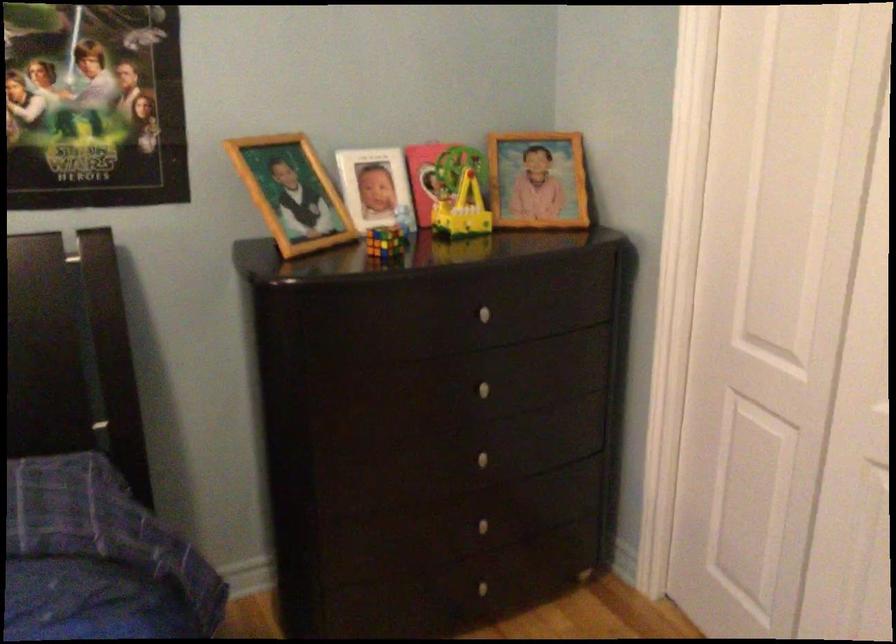
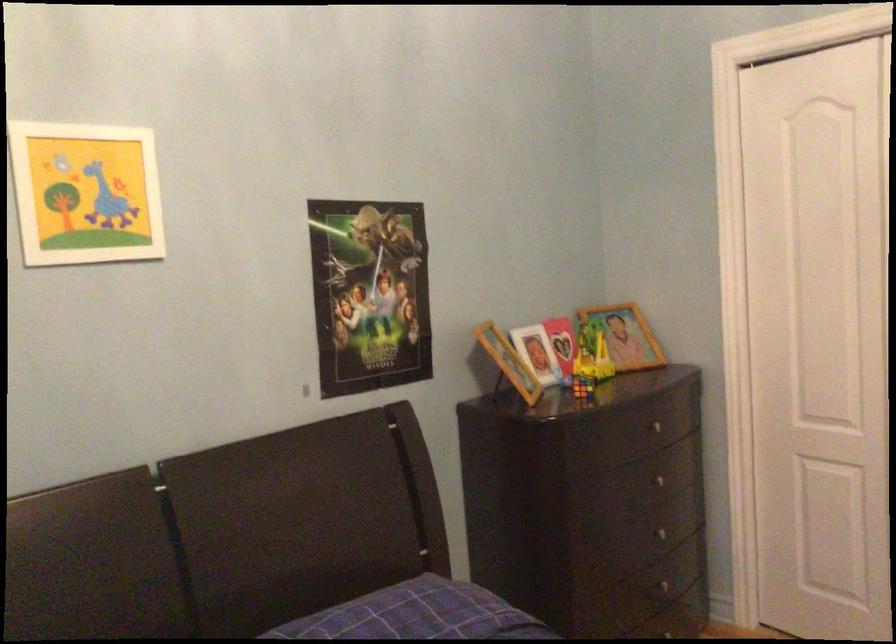
The point at (477,382) is marked in the first image. Where is the corresponding point in the second image?

(656, 480)